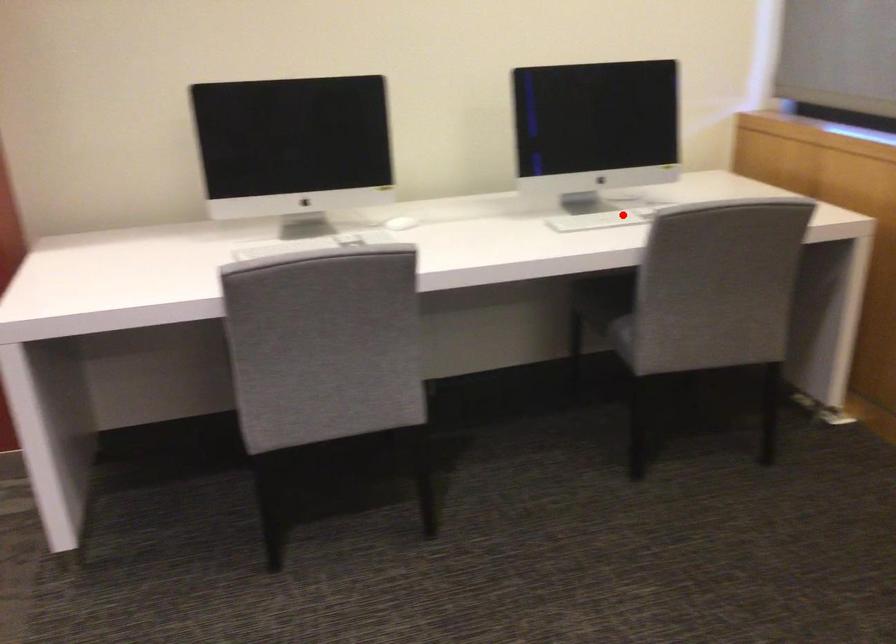
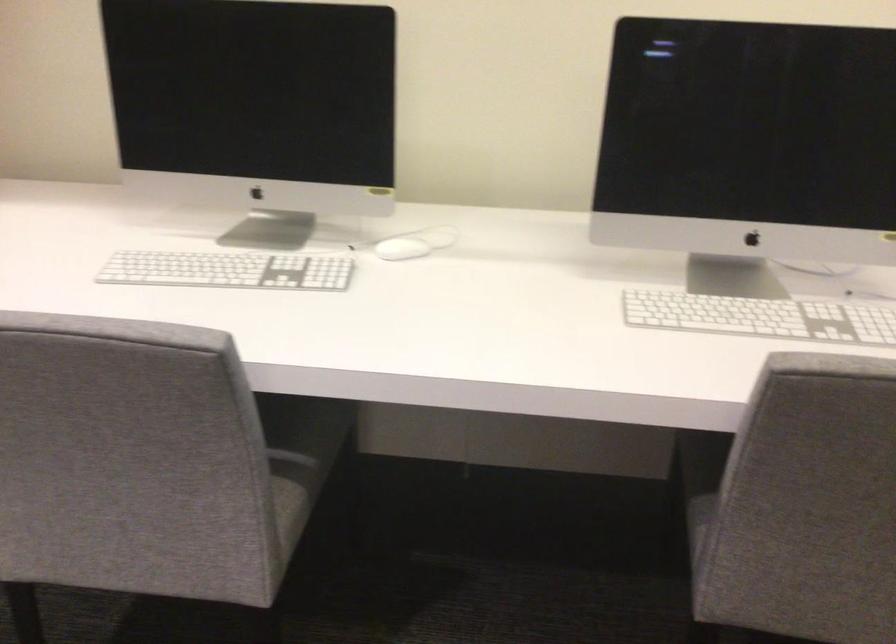
Question: A red point is marked in image1. In image2, is the corresponding 3D point closer to the camera or farther? Reply with the corresponding letter.

Choices:
 (A) The corresponding 3D point is closer.
 (B) The corresponding 3D point is farther.

Answer: (A)